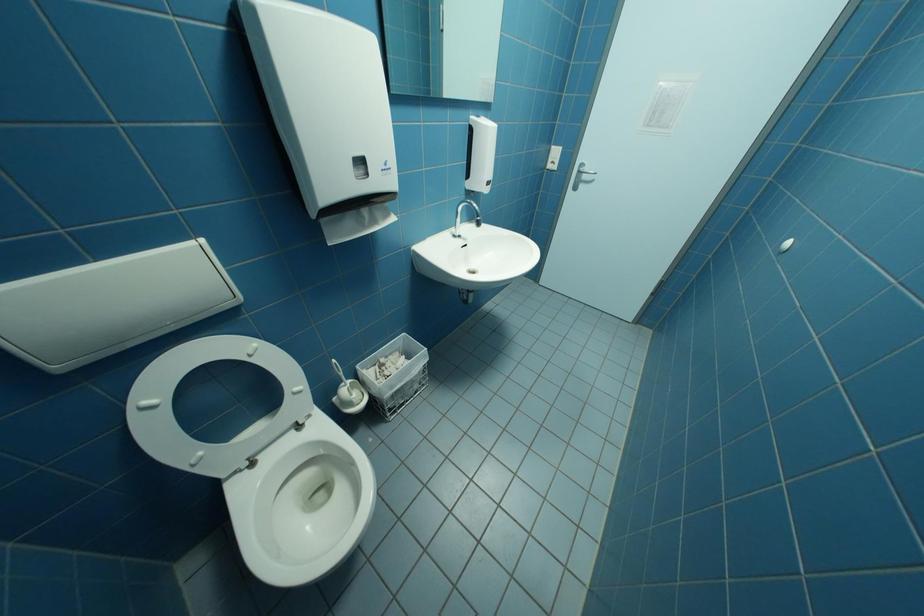
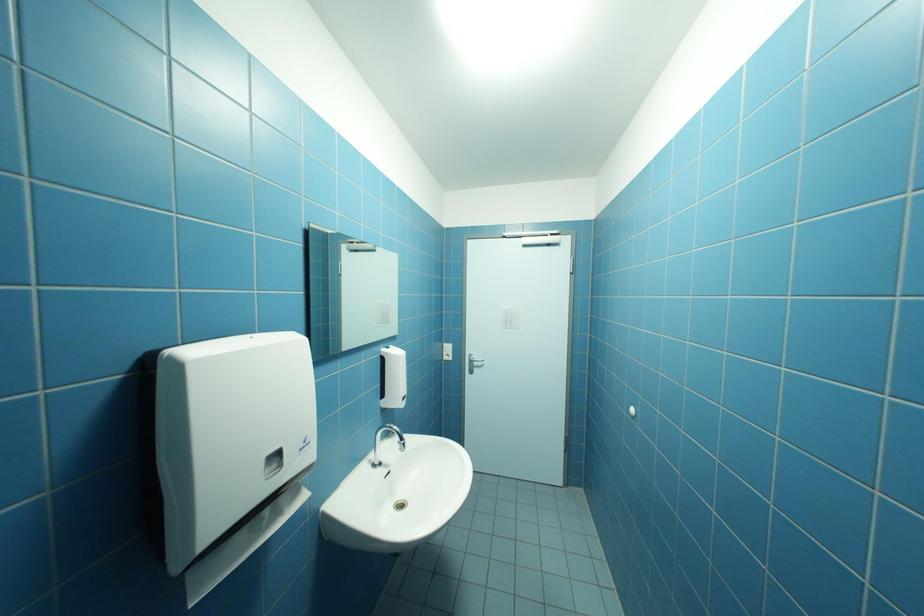
How did the camera likely rotate?

The camera rotated toward right-up.